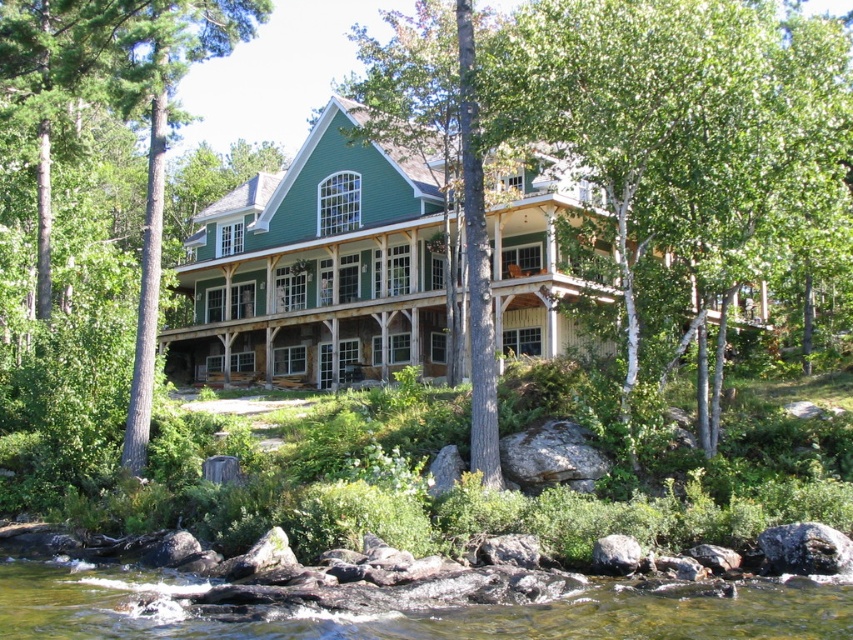
Is clear water at lower center shorter than green wood tree at center?

Correct, clear water at lower center is not as tall as green wood tree at center.

Where is `clear water at lower center`? The width and height of the screenshot is (853, 640). clear water at lower center is located at coordinates (405, 612).

At what (x,y) coordinates should I click in order to perform the action: click on clear water at lower center. Please return your answer as a coordinate pair (x, y). Looking at the image, I should click on (405, 612).

Is wooden porch at center smaller than green wood tree at center?

Incorrect, wooden porch at center is not smaller in size than green wood tree at center.

Which is more to the left, wooden porch at center or green wood tree at center?

From the viewer's perspective, green wood tree at center appears more on the left side.

Is point (401, 250) behind point (54, 13)?

Yes, it is behind point (54, 13).

Where is `wooden porch at center`? The height and width of the screenshot is (640, 853). wooden porch at center is located at coordinates (317, 291).

Which of these two, wooden porch at center or clear water at lower center, stands taller?

wooden porch at center is taller.

Who is positioned more to the right, wooden porch at center or clear water at lower center?

wooden porch at center is more to the right.

What do you see at coordinates (317, 291) in the screenshot? I see `wooden porch at center` at bounding box center [317, 291].

Locate an element on the screen. This screenshot has width=853, height=640. wooden porch at center is located at coordinates (317, 291).